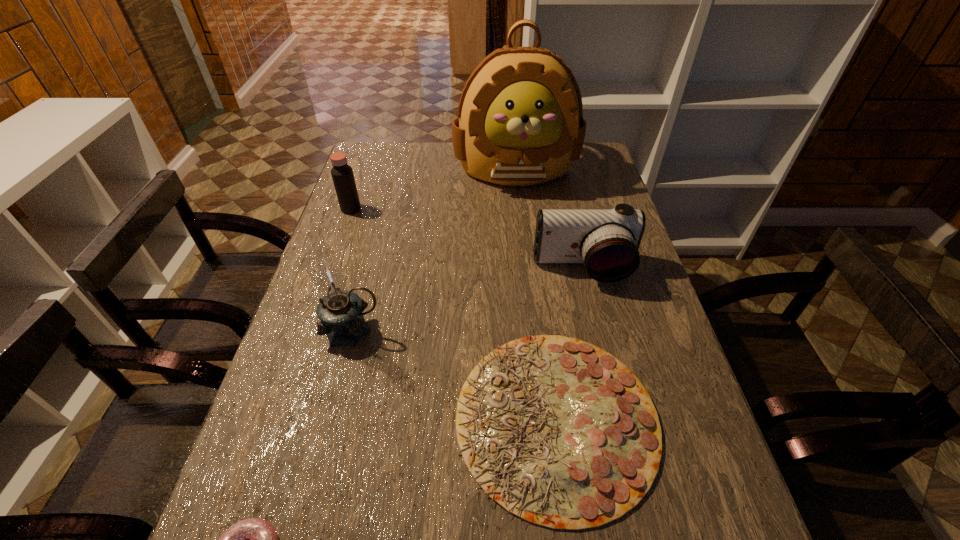
The image size is (960, 540). What are the coordinates of `object that is the closest to the doughnut` in the screenshot? It's located at (560, 433).

Identify the location of object that is the fourth closest one to the oil lamp. (342, 174).

Identify the location of free space that satisfies the following two spatial constraints: 1. on the front-facing side of the farthest object; 2. on the right side of the pizza. This screenshot has height=540, width=960. (542, 419).